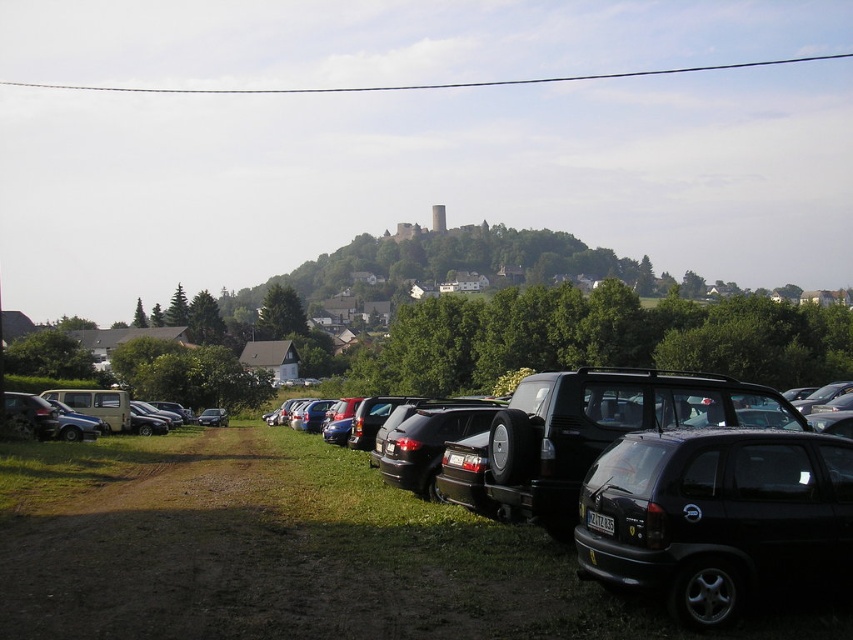
You are standing at the origin point in the parking area. Which direction should you walk to reach the shiny black car at center?

The shiny black car at center is located at point 0.877 on the x axis and 0.497 on the y axis. Since the x coordinate is higher than the y coordinate, you should walk towards the right direction to reach it.

You are standing at the center of the parking area and see the black matte hatchback at lower right. Based on its position, can you estimate how far it is from the center of the parking area in terms of horizontal and vertical distance?

The black matte hatchback at lower right is located at point coordinates of 0.808 on the horizontal axis and 0.842 on the vertical axis. Since the center of the parking area would be at coordinates around 0.5 on both axes, this means the hatchback is approximately 0.308 units to the right and 0.342 units downward from the center.

You are standing at the point marked as point [422,561] in the image. What object is directly in front of you?

The shiny black car at center is located at point [422,561], so the object directly in front of you is the shiny black car at center.